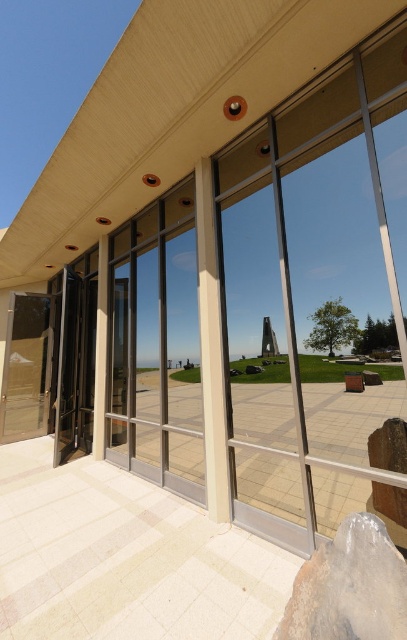
Can you confirm if clear glass pillar at center is wider than white glossy pillar at center?

Yes, clear glass pillar at center is wider than white glossy pillar at center.

Which is behind, point (214, 346) or point (98, 252)?

The point (98, 252) is more distant.

This screenshot has width=407, height=640. Find the location of `clear glass pillar at center`. clear glass pillar at center is located at coordinates (212, 349).

Who is higher up, clear glass window at center or black glass door at left?

black glass door at left is higher up.

Can you confirm if clear glass window at center is wider than black glass door at left?

Yes.

Which is in front, point (126, 285) or point (87, 381)?

Point (126, 285)

Where is `clear glass window at center`? The height and width of the screenshot is (640, 407). clear glass window at center is located at coordinates (157, 346).

Can you confirm if clear glass pillar at center is bigger than black glass door at left?

Actually, clear glass pillar at center might be smaller than black glass door at left.

Does clear glass pillar at center appear on the right side of black glass door at left?

Yes, clear glass pillar at center is to the right of black glass door at left.

This screenshot has height=640, width=407. I want to click on clear glass pillar at center, so click(x=212, y=349).